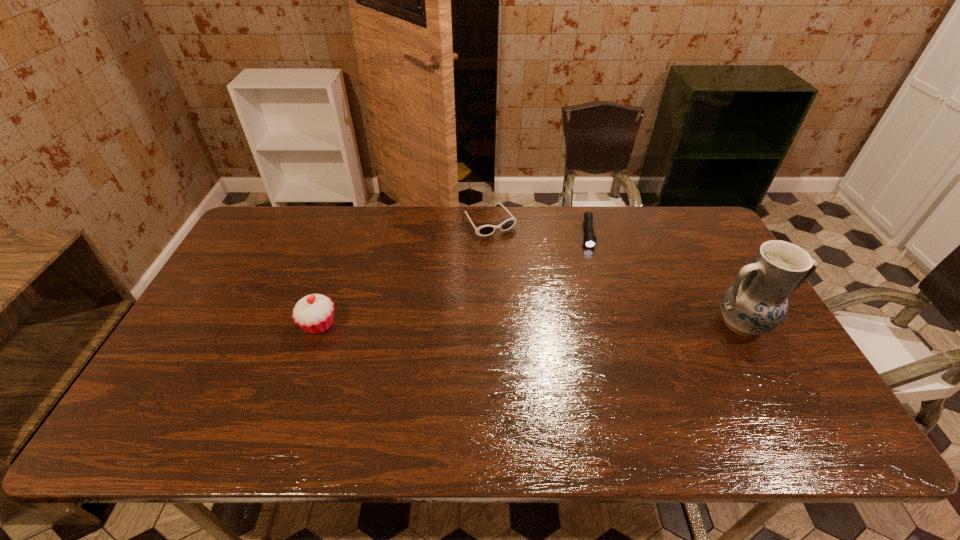
Identify the location of free point that satisfies the following two spatial constraints: 1. on the front side of the second object from left to right; 2. on the left side of the rightmost object. (492, 324).

Identify the location of vacant position in the image that satisfies the following two spatial constraints: 1. on the back side of the sunglasses; 2. on the right side of the second tallest object. (353, 221).